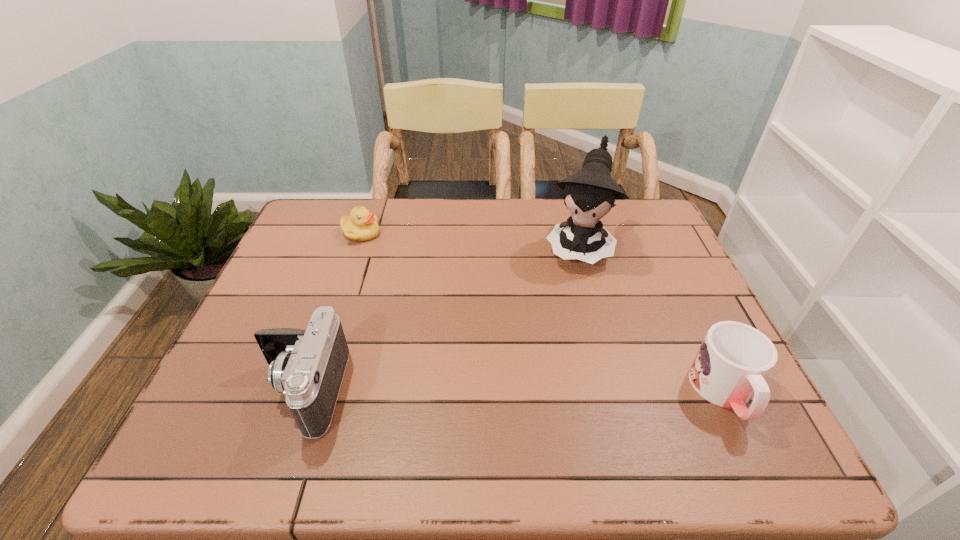
Where is `vacant spot on the desktop that is between the camera and the rightmost object and is positioned on the front-facing side of the shortest object`? The image size is (960, 540). vacant spot on the desktop that is between the camera and the rightmost object and is positioned on the front-facing side of the shortest object is located at coordinates (514, 392).

Where is `vacant space on the desktop that is between the second tallest object and the third tallest object and is positioned at the face of the tallest object`? The image size is (960, 540). vacant space on the desktop that is between the second tallest object and the third tallest object and is positioned at the face of the tallest object is located at coordinates (531, 392).